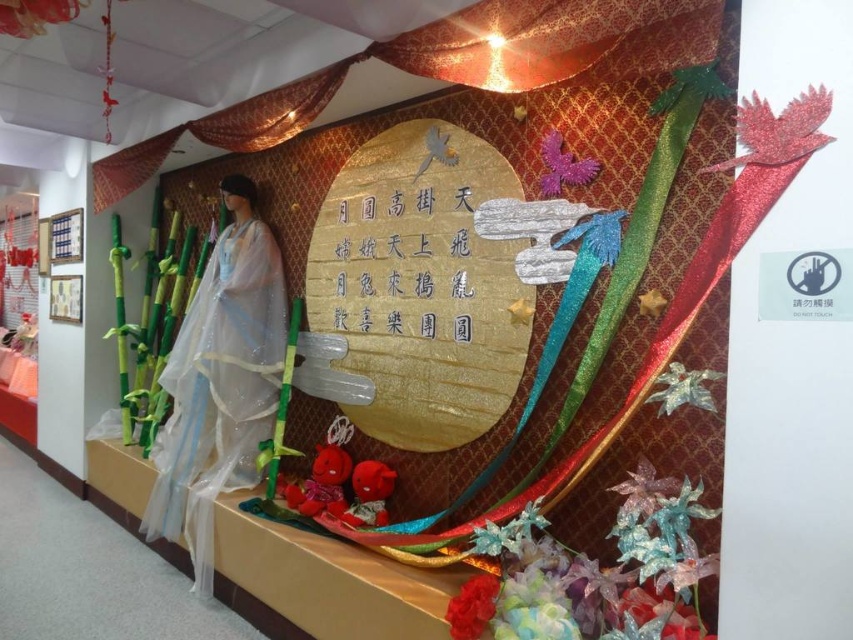
Can you confirm if gold paper lantern at center is bigger than gold shimmering curtain at upper center?

No, gold paper lantern at center is not bigger than gold shimmering curtain at upper center.

Does gold paper lantern at center appear over gold shimmering curtain at upper center?

Actually, gold paper lantern at center is below gold shimmering curtain at upper center.

Find the location of a particular element. This screenshot has width=853, height=640. gold paper lantern at center is located at coordinates (422, 284).

Identify the location of gold paper lantern at center. This screenshot has height=640, width=853. (422, 284).

Between gold paper lantern at center and gold paper writing at center, which one appears on the left side from the viewer's perspective?

From the viewer's perspective, gold paper writing at center appears more on the left side.

Can you confirm if gold paper lantern at center is taller than gold paper writing at center?

Yes, gold paper lantern at center is taller than gold paper writing at center.

Is point (328, 236) behind point (396, 307)?

Yes, it is behind point (396, 307).

The image size is (853, 640). I want to click on gold paper lantern at center, so click(422, 284).

Is point (370, 166) behind point (212, 410)?

No, it is in front of (212, 410).

Which of these two, gold paper lantern at center or translucent white dress at left, stands taller?

Standing taller between the two is translucent white dress at left.

Does point (488, 282) lie in front of point (167, 536)?

That is True.

Where is `gold paper lantern at center`? Image resolution: width=853 pixels, height=640 pixels. gold paper lantern at center is located at coordinates (422, 284).